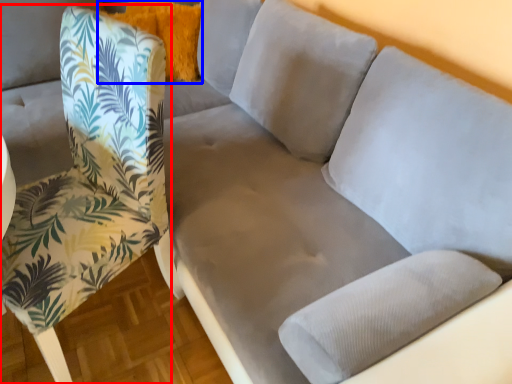
Question: Among these objects, which one is nearest to the camera, chair (highlighted by a red box) or pillow (highlighted by a blue box)?

Choices:
 (A) chair
 (B) pillow

Answer: (A)